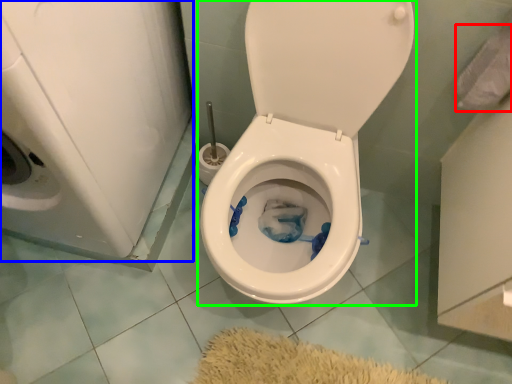
Question: Which object is positioned closest to toilet paper (highlighted by a red box)? Select from washer (highlighted by a blue box) and toilet (highlighted by a green box).

Choices:
 (A) washer
 (B) toilet

Answer: (B)